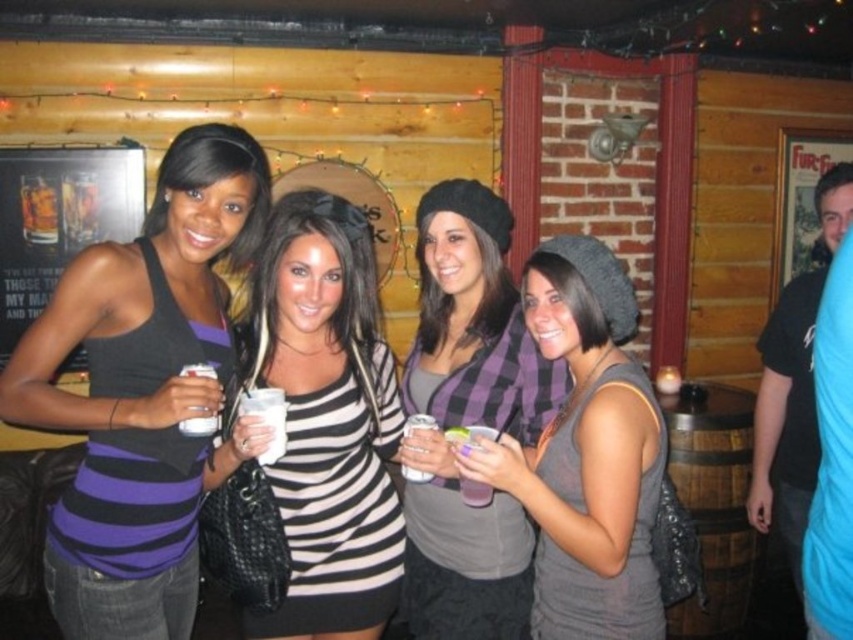
Question: Which point is closer to the camera?

Choices:
 (A) (473, 428)
 (B) (598, 356)

Answer: (A)

Question: Considering the relative positions of plaid fabric scarf at center and clear plastic cup at center in the image provided, where is plaid fabric scarf at center located with respect to clear plastic cup at center?

Choices:
 (A) above
 (B) below

Answer: (A)

Question: Among these objects, which one is nearest to the camera?

Choices:
 (A) clear plastic cup at center
 (B) purple striped tank top at center

Answer: (B)

Question: Is purple striped tank top at center below gray matte beanie at center?

Choices:
 (A) yes
 (B) no

Answer: (B)

Question: Which object is farther from the camera taking this photo?

Choices:
 (A) black and white striped shirt at center
 (B) plaid fabric scarf at center
 (C) clear plastic cup at center
 (D) purple striped tank top at center

Answer: (B)

Question: Does plaid fabric scarf at center appear on the right side of translucent plastic cup at center?

Choices:
 (A) yes
 (B) no

Answer: (B)